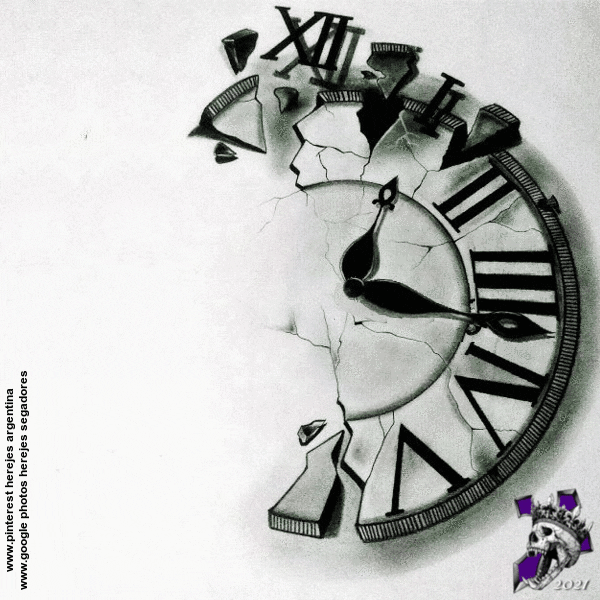
Where is `clock image`? clock image is located at coordinates (322, 208).